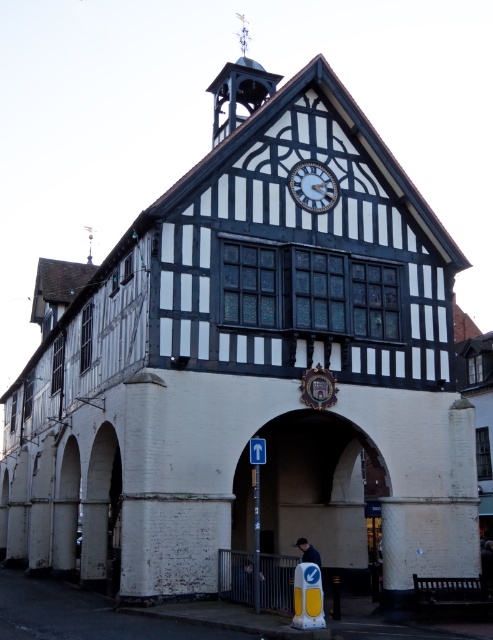
You are an architect examining the historic building. You notice the white glossy clock at upper center and the dark blue fabric jacket at lower center. Which object appears smaller in size?

The white glossy clock at upper center appears smaller in size compared to the dark blue fabric jacket at lower center according to their relative sizes in the image.

You are a painter standing at the entrance of the historic building. You want to paint both the white brick archway at center and the dark blue fabric jacket at lower center. Which object should you focus on first if you want to paint the taller one first?

The white brick archway at center is taller than the dark blue fabric jacket at lower center, so you should focus on painting the white brick archway at center first.

You are standing in front of the historic building and want to take a photo. You notice two points marked on the building at coordinates point (x=322, y=195) and point (x=317, y=557). Which point should you focus on first if you want to capture the closest part of the building in your photo?

Point (x=322, y=195) is further to the camera than point (x=317, y=557). Therefore, to capture the closest part of the building, you should focus on point (x=317, y=557) first.